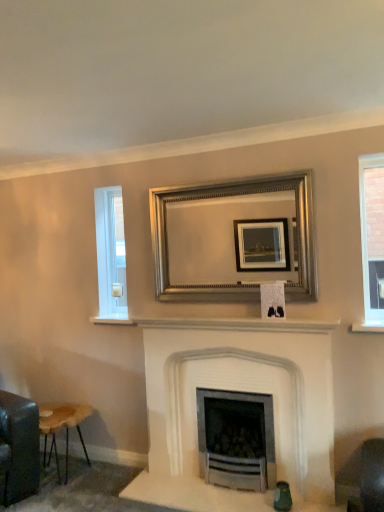
Describe the element at coordinates (61, 426) in the screenshot. This screenshot has width=384, height=512. I see `wooden stool at lower left` at that location.

You are a GUI agent. You are given a task and a screenshot of the screen. Output one action in this format:
    pyautogui.click(x=<x>, y=<y>)
    Task: Click on the wooden stool at lower left
    The image size is (384, 512).
    Given the screenshot: What is the action you would take?
    pyautogui.click(x=61, y=426)

From a real-world perspective, who is located lower, silver/golden metallic picture frame at center or wooden stool at lower left?

wooden stool at lower left.

From the image's perspective, which is below, silver/golden metallic picture frame at center or wooden stool at lower left?

wooden stool at lower left.

Measure the distance between silver/golden metallic picture frame at center and wooden stool at lower left.

The distance of silver/golden metallic picture frame at center from wooden stool at lower left is 1.57 meters.

Which object is thinner, silver/golden metallic picture frame at center or wooden stool at lower left?

With smaller width is silver/golden metallic picture frame at center.

Is white glass window at left, which is counted as the first window, starting from the left, placed right next to white stone fireplace at center?

No, white glass window at left, which is counted as the first window, starting from the left, is not next to white stone fireplace at center.

Which is closer to the camera, (102, 312) or (301, 342)?

The point (301, 342) is closer.

Which is in front, white glass window at left, which is the second window in right-to-left order, or white stone fireplace at center?

white stone fireplace at center is closer to the camera.

From the image's perspective, would you say white glass window at left, which is the second window in right-to-left order, is positioned over white stone fireplace at center?

Yes, from the image's perspective, white glass window at left, which is the second window in right-to-left order, is above white stone fireplace at center.

Is wooden stool at lower left aimed at clear glass window at right, the second window when ordered from back to front?

No, wooden stool at lower left is not turned towards clear glass window at right, the second window when ordered from back to front.

Find the location of a particular element. This screenshot has width=384, height=512. the 2nd window to the right when counting from the wooden stool at lower left is located at coordinates (372, 240).

Which is closer, (84, 406) or (366, 316)?

Clearly, point (84, 406) is more distant from the camera than point (366, 316).

Is white stone fireplace at center with wooden stool at lower left?

No, white stone fireplace at center is not making contact with wooden stool at lower left.

Is white stone fireplace at center taller or shorter than wooden stool at lower left?

Clearly, white stone fireplace at center is taller compared to wooden stool at lower left.

Is white stone fireplace at center to the right of wooden stool at lower left from the viewer's perspective?

Correct, you'll find white stone fireplace at center to the right of wooden stool at lower left.

From a real-world perspective, which object rests below the other?

wooden stool at lower left is physically lower.

Is point (121, 220) behind point (371, 238)?

Yes, point (121, 220) is farther from viewer.

Does white glass window at left, which is counted as the first window, starting from the left, have a smaller size compared to clear glass window at right, which is the first window from right to left?

Yes, white glass window at left, which is counted as the first window, starting from the left, is smaller than clear glass window at right, which is the first window from right to left.

From the image's perspective, is white glass window at left, which is the second window from front to back, above clear glass window at right, which is the first window in front-to-back order?

Actually, white glass window at left, which is the second window from front to back, appears below clear glass window at right, which is the first window in front-to-back order, in the image.

From a real-world perspective, between white glass window at left, which is counted as the first window, starting from the left, and clear glass window at right, the second window when ordered from back to front, who is vertically higher?

From a 3D spatial view, clear glass window at right, the second window when ordered from back to front, is above.

Who is shorter, silver/golden metallic picture frame at center or clear glass window at right, which is the first window in front-to-back order?

With less height is silver/golden metallic picture frame at center.

Is silver/golden metallic picture frame at center oriented towards clear glass window at right, the second window when ordered from back to front?

No, silver/golden metallic picture frame at center is not turned towards clear glass window at right, the second window when ordered from back to front.

Is there a large distance between silver/golden metallic picture frame at center and clear glass window at right, which is the first window in front-to-back order?

Actually, silver/golden metallic picture frame at center and clear glass window at right, which is the first window in front-to-back order, are a little close together.

From the picture: Would you say wooden stool at lower left is a long distance from silver/golden metallic picture frame at center?

That's right, there is a large distance between wooden stool at lower left and silver/golden metallic picture frame at center.

Considering the relative sizes of wooden stool at lower left and silver/golden metallic picture frame at center in the image provided, is wooden stool at lower left smaller than silver/golden metallic picture frame at center?

No.

Is wooden stool at lower left inside or outside of silver/golden metallic picture frame at center?

wooden stool at lower left is located beyond the bounds of silver/golden metallic picture frame at center.

Which is behind, wooden stool at lower left or silver/golden metallic picture frame at center?

wooden stool at lower left is behind.

I want to click on stool to the left of silver/golden metallic picture frame at center, so click(x=61, y=426).

Identify the location of the 1st window above the white stone fireplace at center (from the image's perspective). (111, 256).

Which object lies further to the anchor point silver/golden metallic picture frame at center, white stone fireplace at center or clear glass window at right, the second window when ordered from back to front?

clear glass window at right, the second window when ordered from back to front, is positioned further to the anchor silver/golden metallic picture frame at center.

When comparing their distances from white stone fireplace at center, does clear glass window at right, which is the second window in left-to-right order, or silver/golden metallic picture frame at center seem further?

Among the two, clear glass window at right, which is the second window in left-to-right order, is located further to white stone fireplace at center.

Based on their spatial positions, is white glass window at left, which is the second window in right-to-left order, or white stone fireplace at center closer to wooden stool at lower left?

white glass window at left, which is the second window in right-to-left order, lies closer to wooden stool at lower left than the other object.

Based on their spatial positions, is white glass window at left, which is the 1th window in back-to-front order, or clear glass window at right, which is the first window from right to left, closer to white stone fireplace at center?

The object closer to white stone fireplace at center is white glass window at left, which is the 1th window in back-to-front order.

Which object lies further to the anchor point white glass window at left, which is counted as the first window, starting from the left, wooden stool at lower left or clear glass window at right, which is the first window in front-to-back order?

Among the two, clear glass window at right, which is the first window in front-to-back order, is located further to white glass window at left, which is counted as the first window, starting from the left.

From the image, which object appears to be farther from white stone fireplace at center, wooden stool at lower left or silver/golden metallic picture frame at center?

Based on the image, wooden stool at lower left appears to be further to white stone fireplace at center.

From the image, which object appears to be farther from white glass window at left, which is counted as the first window, starting from the left, white stone fireplace at center or wooden stool at lower left?

Among the two, wooden stool at lower left is located further to white glass window at left, which is counted as the first window, starting from the left.

From the image, which object appears to be farther from wooden stool at lower left, silver/golden metallic picture frame at center or clear glass window at right, the second window when ordered from back to front?

clear glass window at right, the second window when ordered from back to front, lies further to wooden stool at lower left than the other object.

Identify the location of picture frame between wooden stool at lower left and clear glass window at right, which is the first window from right to left, from left to right. The height and width of the screenshot is (512, 384). (234, 239).

You are a GUI agent. You are given a task and a screenshot of the screen. Output one action in this format:
    pyautogui.click(x=<x>, y=<y>)
    Task: Click on the fireplace between silver/golden metallic picture frame at center and wooden stool at lower left vertically
    The image size is (384, 512).
    Given the screenshot: What is the action you would take?
    point(239,390)

I want to click on fireplace between wooden stool at lower left and clear glass window at right, which is the first window in front-to-back order, so click(x=239, y=390).

This screenshot has width=384, height=512. What are the coordinates of `picture frame between white glass window at left, which is the second window in right-to-left order, and clear glass window at right, the second window when ordered from back to front` in the screenshot? It's located at (234, 239).